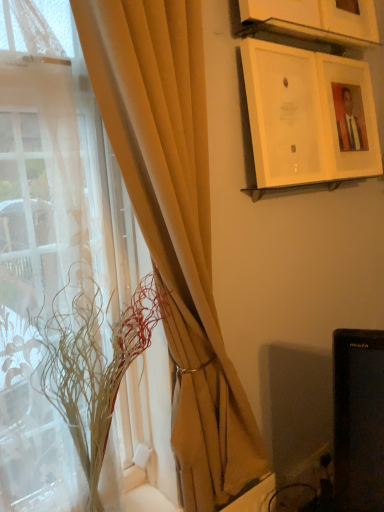
Question: Is translucent glass vase at left to the left of matte beige curtain at left from the viewer's perspective?

Choices:
 (A) no
 (B) yes

Answer: (B)

Question: Is translucent glass vase at left not near matte beige curtain at left?

Choices:
 (A) no
 (B) yes

Answer: (A)

Question: Does translucent glass vase at left have a smaller size compared to matte beige curtain at left?

Choices:
 (A) yes
 (B) no

Answer: (A)

Question: Does translucent glass vase at left have a greater height compared to matte beige curtain at left?

Choices:
 (A) no
 (B) yes

Answer: (A)

Question: From the image's perspective, is translucent glass vase at left beneath matte beige curtain at left?

Choices:
 (A) no
 (B) yes

Answer: (B)

Question: Would you say wooden picture frame at upper center, arranged as the 1th picture frame when viewed from the top, is to the left or to the right of matte white picture frame at upper right, arranged as the second picture frame when viewed from the top, in the picture?

Choices:
 (A) right
 (B) left

Answer: (B)

Question: Is wooden picture frame at upper center, which is counted as the 3th picture frame, starting from the bottom, taller or shorter than matte white picture frame at upper right, arranged as the second picture frame when viewed from the top?

Choices:
 (A) tall
 (B) short

Answer: (B)

Question: Is wooden picture frame at upper center, which is counted as the 3th picture frame, starting from the bottom, situated inside matte white picture frame at upper right, arranged as the second picture frame when viewed from the top, or outside?

Choices:
 (A) outside
 (B) inside

Answer: (A)

Question: Is point (344, 17) closer or farther from the camera than point (367, 140)?

Choices:
 (A) farther
 (B) closer

Answer: (B)

Question: In terms of width, does matte white picture frame at upper right, acting as the second picture frame starting from the bottom, look wider or thinner when compared to translucent glass vase at left?

Choices:
 (A) thin
 (B) wide

Answer: (A)

Question: Is point coord(332,116) closer or farther from the camera than point coord(69,350)?

Choices:
 (A) farther
 (B) closer

Answer: (A)

Question: From a real-world perspective, is matte white picture frame at upper right, acting as the second picture frame starting from the bottom, above or below translucent glass vase at left?

Choices:
 (A) below
 (B) above

Answer: (B)

Question: Is matte white picture frame at upper right, acting as the second picture frame starting from the bottom, spatially inside translucent glass vase at left, or outside of it?

Choices:
 (A) inside
 (B) outside

Answer: (B)

Question: Considering the positions of point (192, 138) and point (370, 100), is point (192, 138) closer or farther from the camera than point (370, 100)?

Choices:
 (A) farther
 (B) closer

Answer: (B)

Question: Considering the positions of matte beige curtain at left and matte white picture frame at upper right, arranged as the second picture frame when viewed from the top, in the image, is matte beige curtain at left taller or shorter than matte white picture frame at upper right, arranged as the second picture frame when viewed from the top,?

Choices:
 (A) tall
 (B) short

Answer: (A)